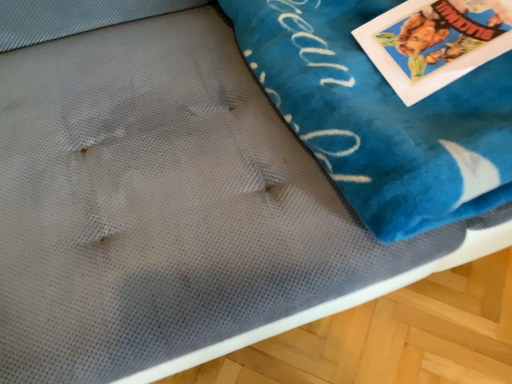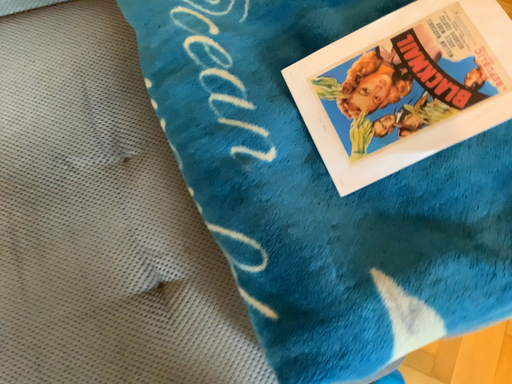
Question: Which way did the camera rotate in the video?

Choices:
 (A) rotated downward
 (B) rotated upward

Answer: (A)